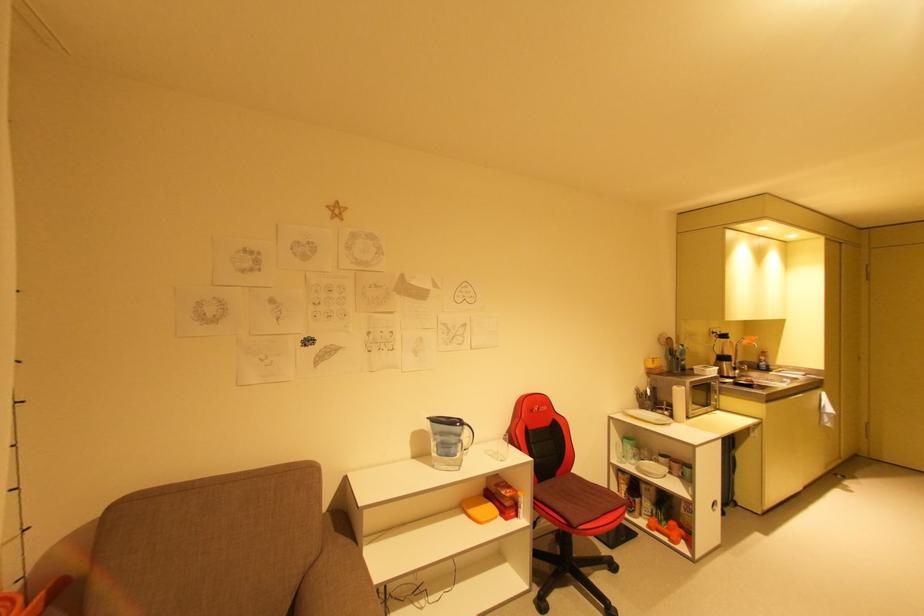
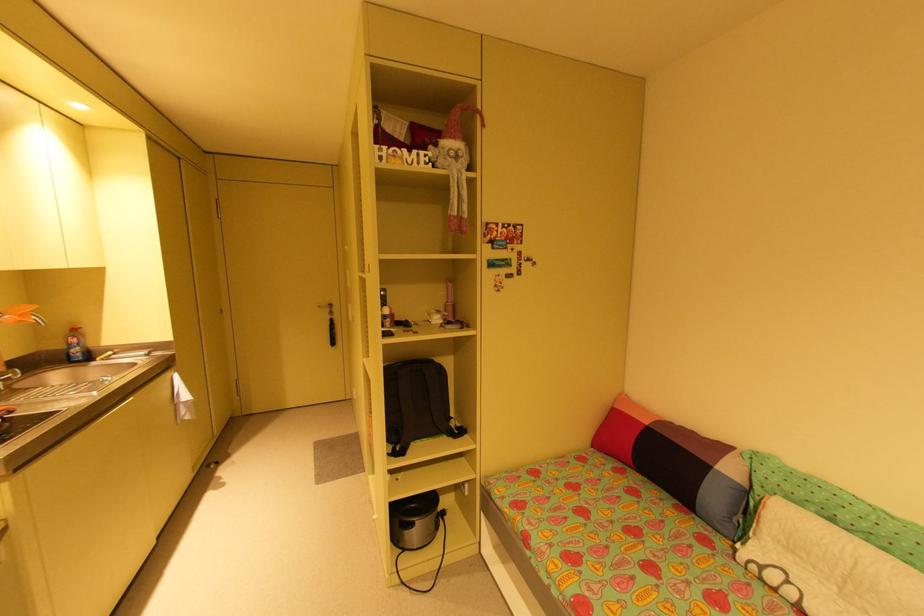
Find the pixel in the second image that matches point (756, 341) in the first image.

(25, 315)